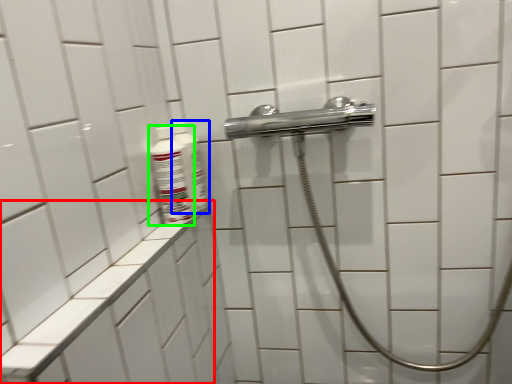
Question: Considering the real-world distances, which object is farthest from ledge (highlighted by a red box)? mouthwash (highlighted by a blue box) or mouthwash (highlighted by a green box)?

Choices:
 (A) mouthwash
 (B) mouthwash

Answer: (A)